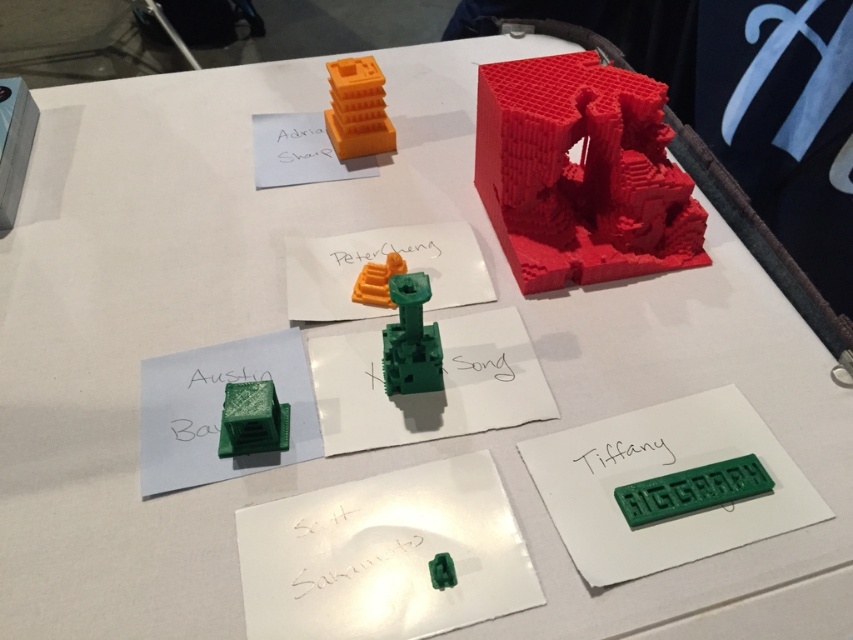
Is green matte block at lower left smaller than orange matte toy at center?

No.

Is point (235, 442) positioned behind point (387, 266)?

No, it is in front of (387, 266).

The width and height of the screenshot is (853, 640). What are the coordinates of `green matte block at lower left` in the screenshot? It's located at (252, 419).

In the scene shown: Is orange matte tower at upper center shorter than green plastic toy at center?

In fact, orange matte tower at upper center may be taller than green plastic toy at center.

Is the position of orange matte tower at upper center less distant than that of green plastic toy at center?

No, it is behind green plastic toy at center.

Does point (378, 134) come closer to viewer compared to point (451, 564)?

No, (378, 134) is further to viewer.

Find the location of a particular element. Image resolution: width=853 pixels, height=640 pixels. orange matte tower at upper center is located at coordinates (357, 108).

Who is shorter, red matte sculpture at upper right or green matte block at lower left?

Standing shorter between the two is green matte block at lower left.

Which is behind, point (583, 237) or point (247, 410)?

The point (583, 237) is more distant.

Who is more distant from viewer, (560, 136) or (257, 440)?

Positioned behind is point (560, 136).

The width and height of the screenshot is (853, 640). I want to click on red matte sculpture at upper right, so click(x=581, y=172).